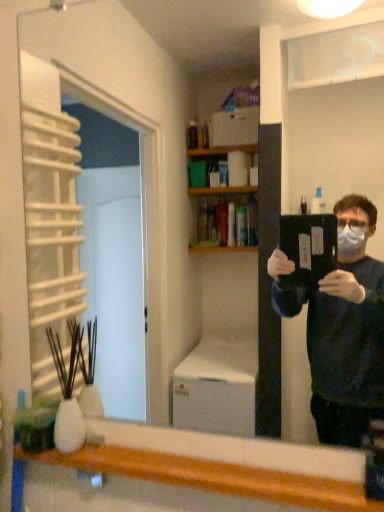
This screenshot has width=384, height=512. I want to click on wooden ledge at lower center, so [x=224, y=465].

What do you see at coordinates (224, 465) in the screenshot? I see `wooden ledge at lower center` at bounding box center [224, 465].

At what (x,y) coordinates should I click in order to perform the action: click on wooden ledge at lower center. Please return your answer as a coordinate pair (x, y). The width and height of the screenshot is (384, 512). Looking at the image, I should click on (224, 465).